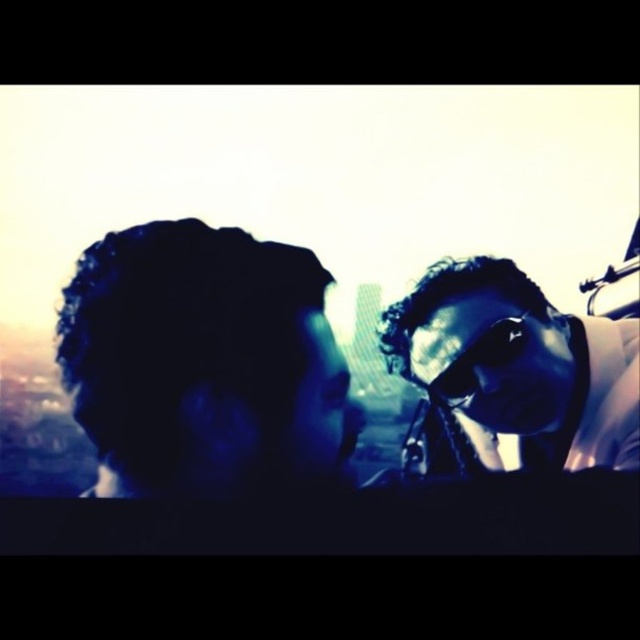
You are a photographer trying to adjust the focus of your camera. You want to ensure both the dark curly hair at left and the sunglasses at center are in focus. Based on their heights, which one should you focus on first to maximize the depth of field?

The dark curly hair at left is shorter than sunglasses at center. To maximize depth of field, focus on the sunglasses at center since it is taller and closer to the background, allowing both subjects to be in focus.

You are standing at the point with coordinates point (500, 355) and want to walk towards the point with coordinates point (403, 301). Is the point you want to reach in front of or behind you?

The point (403, 301) is behind point (500, 355), so the point you want to reach is behind you.